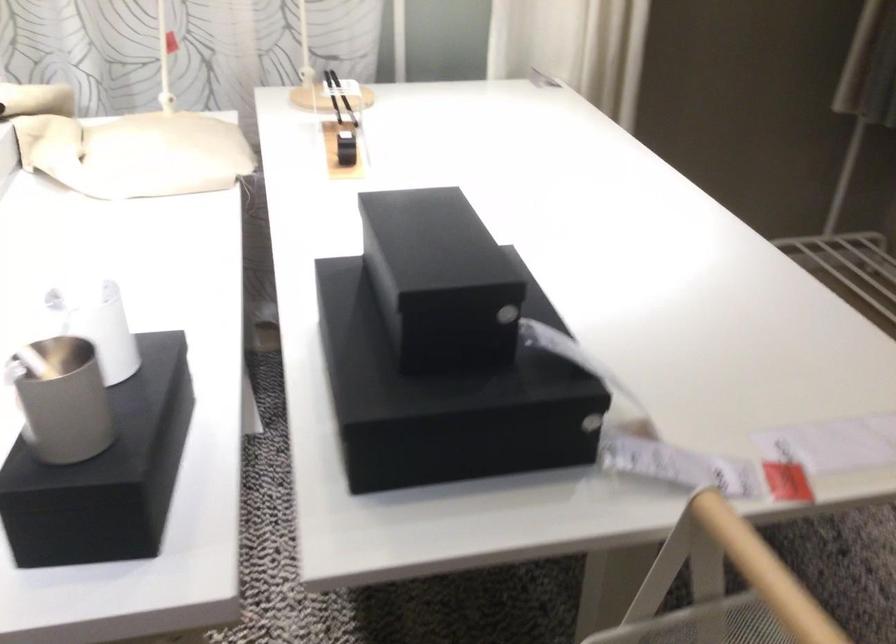
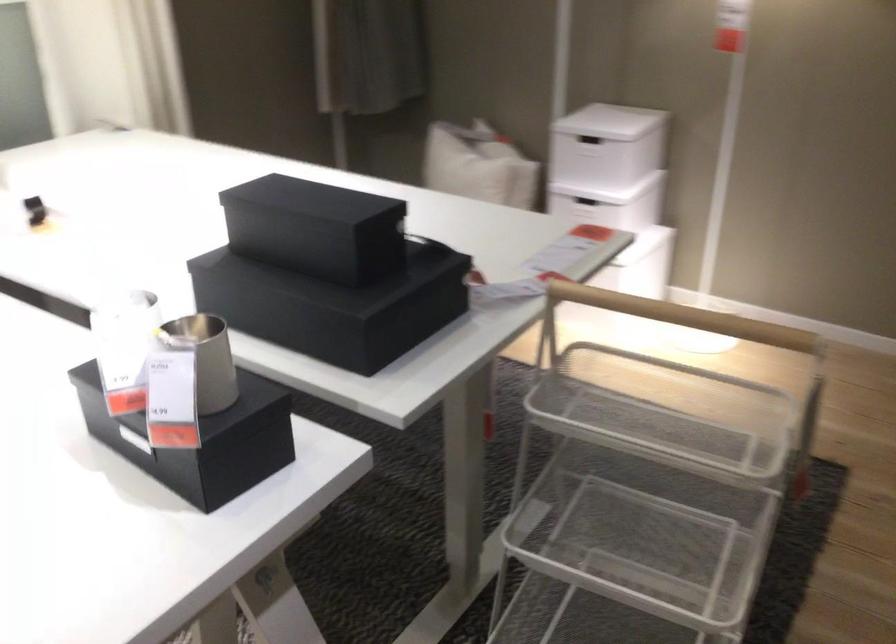
In the second image, find the point that corresponds to (x=101, y=299) in the first image.

(122, 313)